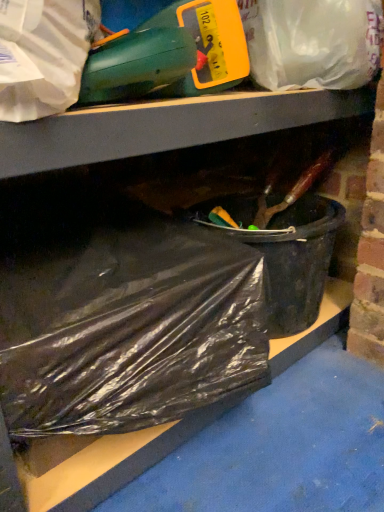
The height and width of the screenshot is (512, 384). What do you see at coordinates (287, 254) in the screenshot? I see `black plastic bucket at lower right` at bounding box center [287, 254].

Describe the element at coordinates (312, 42) in the screenshot. I see `translucent plastic bag at upper center, which is the 2th plastic bag in bottom-to-top order` at that location.

Where is `translucent plastic bag at upper center, the first plastic bag when ordered from top to bottom`? Image resolution: width=384 pixels, height=512 pixels. translucent plastic bag at upper center, the first plastic bag when ordered from top to bottom is located at coordinates (312, 42).

In order to click on black plastic bucket at lower right in this screenshot , I will do `click(287, 254)`.

Is black plastic bag at lower left, the first plastic bag ordered from the bottom, at the right side of translucent plastic bag at upper center, the first plastic bag when ordered from top to bottom?

Incorrect, black plastic bag at lower left, the first plastic bag ordered from the bottom, is not on the right side of translucent plastic bag at upper center, the first plastic bag when ordered from top to bottom.

Consider the image. Between black plastic bag at lower left, the first plastic bag ordered from the bottom, and translucent plastic bag at upper center, the first plastic bag when ordered from top to bottom, which one has less height?

Standing shorter between the two is translucent plastic bag at upper center, the first plastic bag when ordered from top to bottom.

From a real-world perspective, does black plastic bag at lower left, the first plastic bag ordered from the bottom, sit lower than translucent plastic bag at upper center, the first plastic bag when ordered from top to bottom?

Yes, from a real-world perspective, black plastic bag at lower left, the first plastic bag ordered from the bottom, is below translucent plastic bag at upper center, the first plastic bag when ordered from top to bottom.

Could you tell me if black plastic bag at lower left, positioned as the 2th plastic bag in top-to-bottom order, is turned towards translucent plastic bag at upper center, which is the 2th plastic bag in bottom-to-top order?

No.

Is black plastic bucket at lower right positioned with its back to translucent plastic bag at upper center, the first plastic bag when ordered from top to bottom?

No, translucent plastic bag at upper center, the first plastic bag when ordered from top to bottom, is not at the back of black plastic bucket at lower right.

Does black plastic bucket at lower right lie behind translucent plastic bag at upper center, the first plastic bag when ordered from top to bottom?

Yes, it is behind translucent plastic bag at upper center, the first plastic bag when ordered from top to bottom.

Are black plastic bucket at lower right and translucent plastic bag at upper center, which is the 2th plastic bag in bottom-to-top order, located far from each other?

They are positioned close to each other.

From a real-world perspective, between black plastic bucket at lower right and translucent plastic bag at upper center, the first plastic bag when ordered from top to bottom, who is vertically lower?

black plastic bucket at lower right, from a real-world perspective.

Can we say translucent plastic bag at upper center, which is the 2th plastic bag in bottom-to-top order, lies outside black plastic bag at lower left, the first plastic bag ordered from the bottom?

Yes, translucent plastic bag at upper center, which is the 2th plastic bag in bottom-to-top order, is located beyond the bounds of black plastic bag at lower left, the first plastic bag ordered from the bottom.

Considering their positions, is translucent plastic bag at upper center, the first plastic bag when ordered from top to bottom, located in front of or behind black plastic bag at lower left, positioned as the 2th plastic bag in top-to-bottom order?

Visually, translucent plastic bag at upper center, the first plastic bag when ordered from top to bottom, is located behind black plastic bag at lower left, positioned as the 2th plastic bag in top-to-bottom order.

Is translucent plastic bag at upper center, the first plastic bag when ordered from top to bottom, aimed at black plastic bag at lower left, the first plastic bag ordered from the bottom?

No, translucent plastic bag at upper center, the first plastic bag when ordered from top to bottom, is not facing towards black plastic bag at lower left, the first plastic bag ordered from the bottom.

The height and width of the screenshot is (512, 384). I want to click on plastic bag behind the black plastic bag at lower left, positioned as the 2th plastic bag in top-to-bottom order, so click(x=312, y=42).

Considering the positions of objects black plastic bucket at lower right and black plastic bag at lower left, the first plastic bag ordered from the bottom, in the image provided, who is behind, black plastic bucket at lower right or black plastic bag at lower left, the first plastic bag ordered from the bottom,?

black plastic bucket at lower right is further from the camera.

From the image's perspective, between black plastic bucket at lower right and black plastic bag at lower left, positioned as the 2th plastic bag in top-to-bottom order, who is located below?

black plastic bag at lower left, positioned as the 2th plastic bag in top-to-bottom order.

How many degrees apart are the facing directions of black plastic bucket at lower right and black plastic bag at lower left, the first plastic bag ordered from the bottom?

The angular difference between black plastic bucket at lower right and black plastic bag at lower left, the first plastic bag ordered from the bottom, is 0.000731 degrees.

How much distance is there between translucent plastic bag at upper center, the first plastic bag when ordered from top to bottom, and black plastic bucket at lower right?

A distance of 12.34 inches exists between translucent plastic bag at upper center, the first plastic bag when ordered from top to bottom, and black plastic bucket at lower right.

Between point (288, 12) and point (315, 244), which one is positioned in front?

The point (288, 12) is in front.

From the image's perspective, between translucent plastic bag at upper center, which is the 2th plastic bag in bottom-to-top order, and black plastic bucket at lower right, which one is located above?

translucent plastic bag at upper center, which is the 2th plastic bag in bottom-to-top order, is shown above in the image.

What's the angular difference between translucent plastic bag at upper center, which is the 2th plastic bag in bottom-to-top order, and black plastic bucket at lower right's facing directions?

They differ by 5.05 degrees in their facing directions.

Relative to black plastic bucket at lower right, is black plastic bag at lower left, positioned as the 2th plastic bag in top-to-bottom order, in front or behind?

black plastic bag at lower left, positioned as the 2th plastic bag in top-to-bottom order, is in front of black plastic bucket at lower right.

Which of these two, black plastic bag at lower left, positioned as the 2th plastic bag in top-to-bottom order, or black plastic bucket at lower right, stands taller?

black plastic bag at lower left, positioned as the 2th plastic bag in top-to-bottom order.

Image resolution: width=384 pixels, height=512 pixels. What are the coordinates of `plastic bag below the black plastic bucket at lower right (from the image's perspective)` in the screenshot? It's located at (124, 323).

From a real-world perspective, is black plastic bag at lower left, the first plastic bag ordered from the bottom, over black plastic bucket at lower right?

Yes, from a real-world perspective, black plastic bag at lower left, the first plastic bag ordered from the bottom, is over black plastic bucket at lower right

The width and height of the screenshot is (384, 512). I want to click on plastic bag that is in front of the translucent plastic bag at upper center, the first plastic bag when ordered from top to bottom, so click(x=124, y=323).

The width and height of the screenshot is (384, 512). I want to click on recycling bin on the left of translucent plastic bag at upper center, which is the 2th plastic bag in bottom-to-top order, so click(287, 254).

Which object lies nearer to the anchor point black plastic bucket at lower right, translucent plastic bag at upper center, the first plastic bag when ordered from top to bottom, or black plastic bag at lower left, positioned as the 2th plastic bag in top-to-bottom order?

black plastic bag at lower left, positioned as the 2th plastic bag in top-to-bottom order, lies closer to black plastic bucket at lower right than the other object.

Considering their positions, is black plastic bag at lower left, positioned as the 2th plastic bag in top-to-bottom order, positioned further to black plastic bucket at lower right than translucent plastic bag at upper center, the first plastic bag when ordered from top to bottom?

The object further to black plastic bucket at lower right is translucent plastic bag at upper center, the first plastic bag when ordered from top to bottom.

Estimate the real-world distances between objects in this image. Which object is further from translucent plastic bag at upper center, the first plastic bag when ordered from top to bottom, black plastic bucket at lower right or black plastic bag at lower left, the first plastic bag ordered from the bottom?

Based on the image, black plastic bag at lower left, the first plastic bag ordered from the bottom, appears to be further to translucent plastic bag at upper center, the first plastic bag when ordered from top to bottom.

Looking at the image, which one is located closer to translucent plastic bag at upper center, the first plastic bag when ordered from top to bottom, black plastic bag at lower left, positioned as the 2th plastic bag in top-to-bottom order, or black plastic bucket at lower right?

black plastic bucket at lower right lies closer to translucent plastic bag at upper center, the first plastic bag when ordered from top to bottom, than the other object.

In the scene shown: When comparing their distances from black plastic bag at lower left, positioned as the 2th plastic bag in top-to-bottom order, does black plastic bucket at lower right or translucent plastic bag at upper center, which is the 2th plastic bag in bottom-to-top order, seem closer?

black plastic bucket at lower right is positioned closer to the anchor black plastic bag at lower left, positioned as the 2th plastic bag in top-to-bottom order.

In the scene shown: When comparing their distances from black plastic bag at lower left, positioned as the 2th plastic bag in top-to-bottom order, does translucent plastic bag at upper center, the first plastic bag when ordered from top to bottom, or black plastic bucket at lower right seem further?

translucent plastic bag at upper center, the first plastic bag when ordered from top to bottom, lies further to black plastic bag at lower left, positioned as the 2th plastic bag in top-to-bottom order, than the other object.

Where is `recycling bin that lies between translucent plastic bag at upper center, the first plastic bag when ordered from top to bottom, and black plastic bag at lower left, positioned as the 2th plastic bag in top-to-bottom order, from top to bottom`? recycling bin that lies between translucent plastic bag at upper center, the first plastic bag when ordered from top to bottom, and black plastic bag at lower left, positioned as the 2th plastic bag in top-to-bottom order, from top to bottom is located at coordinates (287, 254).